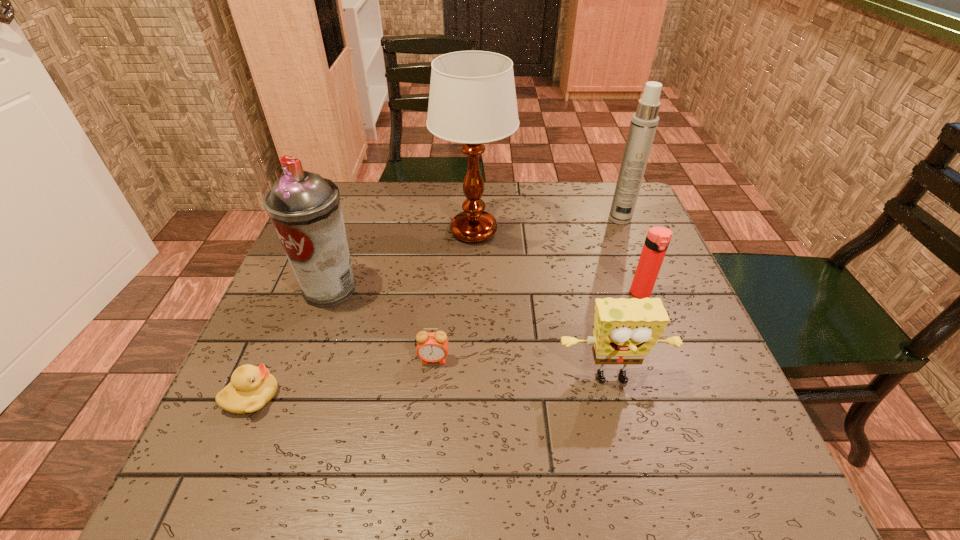
The image size is (960, 540). In order to click on free space that satisfies the following two spatial constraints: 1. on the back side of the nearer aerosol can; 2. on the left side of the table lamp in this screenshot , I will do `click(350, 231)`.

The image size is (960, 540). Find the location of `free location that satisfies the following two spatial constraints: 1. on the front side of the thermos bottle; 2. on the front-facing side of the duckling`. free location that satisfies the following two spatial constraints: 1. on the front side of the thermos bottle; 2. on the front-facing side of the duckling is located at coordinates (679, 396).

Where is `vacant region that satisfies the following two spatial constraints: 1. on the front-facing side of the sponge; 2. on the front-facing side of the shortest object`? vacant region that satisfies the following two spatial constraints: 1. on the front-facing side of the sponge; 2. on the front-facing side of the shortest object is located at coordinates (616, 396).